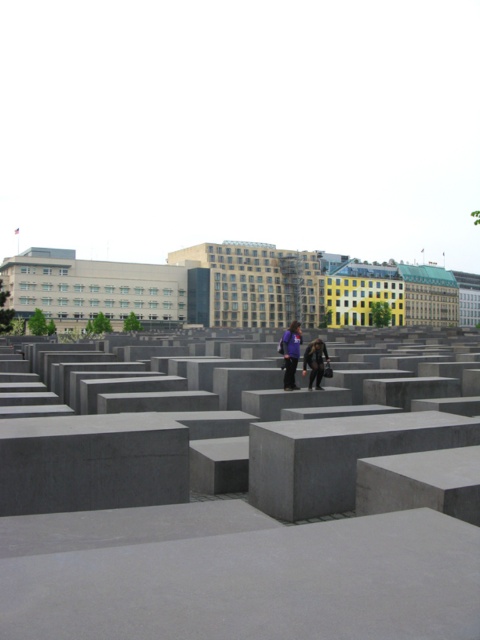
You are standing at the entrance of the maze formed by the dark gray concrete blocks at center and the purple fabric jacket at center. Which object is closer to your right side?

The purple fabric jacket at center is to the right of dark gray concrete blocks at center, so it is closer to your right side.

You are standing at the entrance of the maze formed by the concrete blocks and see two points marked in the image. The first point is at coordinates point (410, 458) and the second is at point (309, 360). Which point is closer to you as you stand at the entrance?

Point (410, 458) is closer to the camera than point (309, 360), so the first point is closer to you as you stand at the entrance.